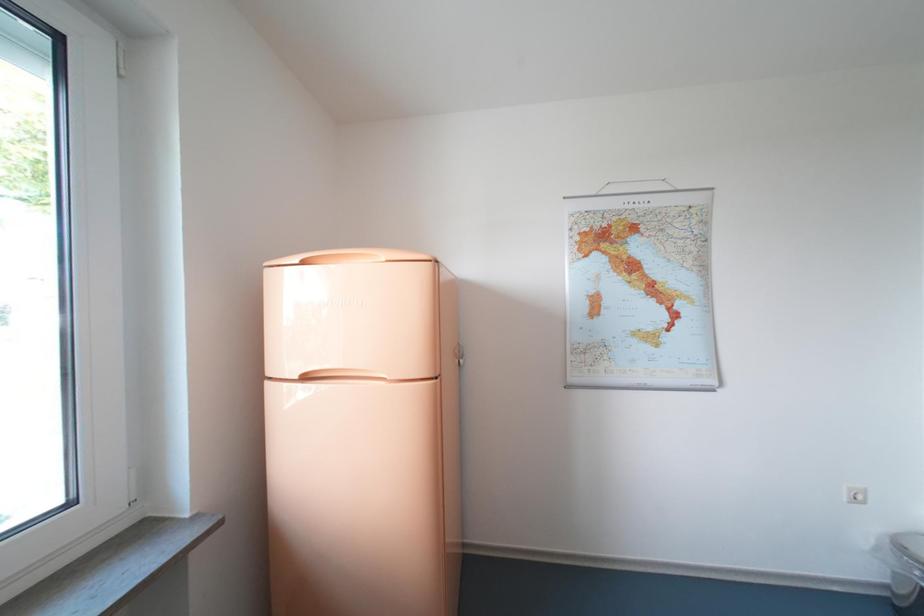
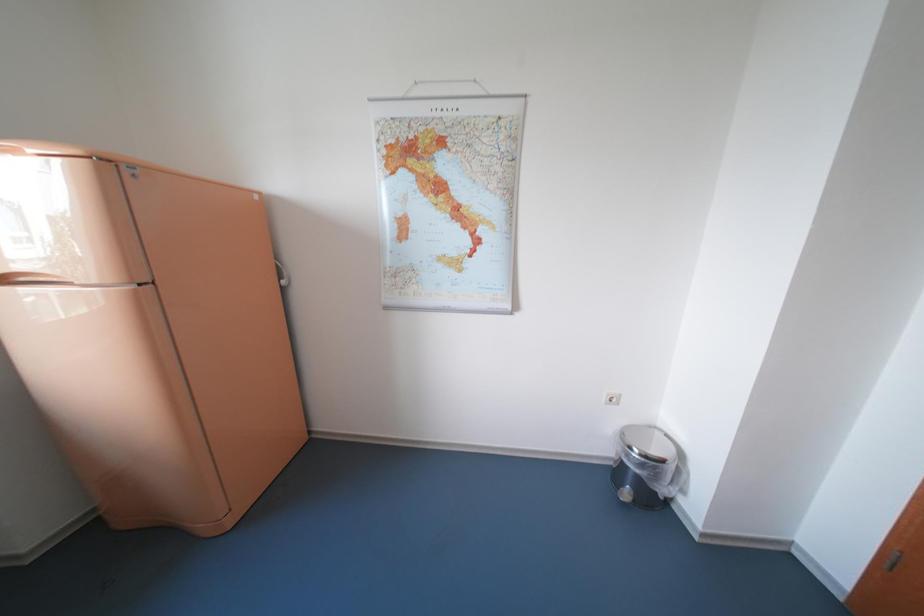
Question: Based on the continuous images, in which direction is the camera rotating? Reply with the corresponding letter.

Choices:
 (A) Left
 (B) Right
 (C) Up
 (D) Down

Answer: (D)